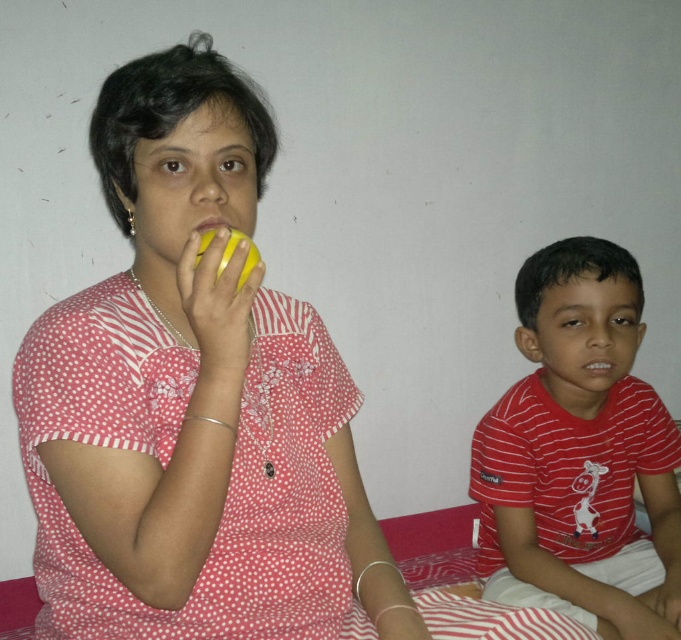
You are organizing a picnic basket and need to pack both the red striped shirt at right and the yellow matte apple at upper left. If the basket has limited space, which item should you place first to ensure both fit?

The red striped shirt at right is larger in size than the yellow matte apple at upper left, so you should place the larger red striped shirt at right first to make space for the smaller apple.

Based on the photo, you are a photographer trying to capture a closeup shot of the yellow matte apple at upper left while also including the red striped shirt at right in the frame. Given that your camera has a fixed focal length lens, which object should you position closer to the camera to ensure both are in focus?

To ensure both the red striped shirt at right and the yellow matte apple at upper left are in focus, you should position the red striped shirt at right closer to the camera. Since it is already 30.77 inches away from the apple, moving the shirt closer would reduce the distance between them, helping maintain depth of field.